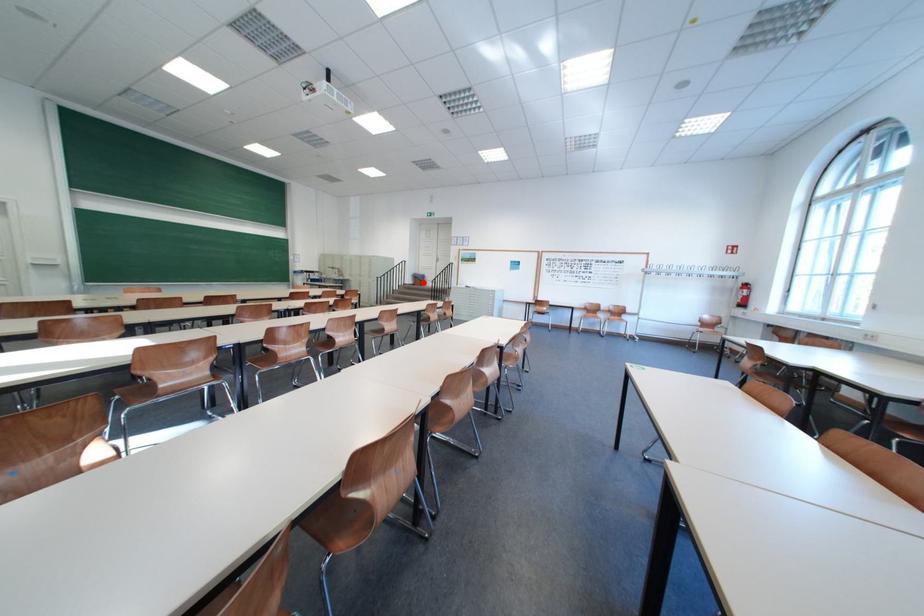
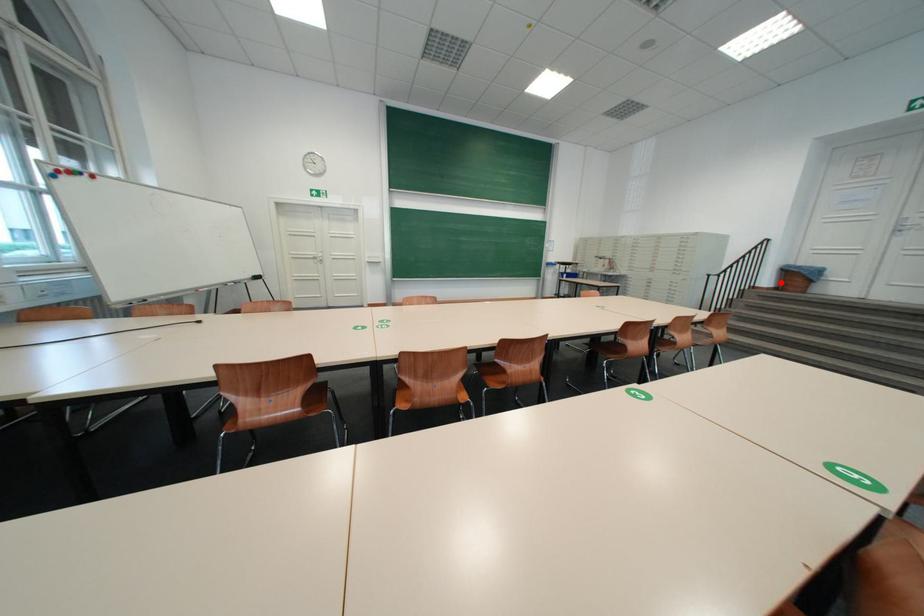
I am providing you with two images of the same scene from different viewpoints. A red point is marked on the first image and another point is marked on the second image. Does the point marked in image1 correspond to the same location as the one in image2?

Yes